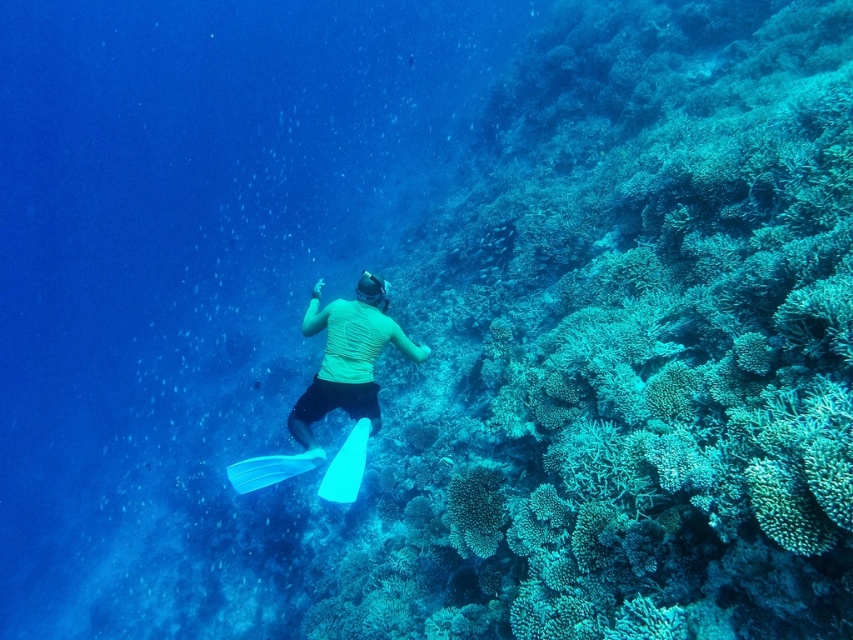
You are an underwater photographer aiming to capture a closeup of the green textured coral at center without the transparent plastic paddle at lower center blocking the view. Based on their heights, can you position yourself below the coral to frame the shot?

The green textured coral at center has a lesser height compared to transparent plastic paddle at lower center. Positioning yourself below the coral would allow the shot since the paddle is taller and might block the view from above, but being lower could let you capture the coral without obstruction.

You are an underwater photographer aiming to capture the green textured coral reef at center and the transparent plastic paddle at lower center in a single shot. Which object will appear closer to the camera in the photo?

The green textured coral reef at center will appear closer to the camera because the transparent plastic paddle at lower center is behind it.

You are an underwater photographer aiming to capture a clear shot of the diver and the coral reef. You notice two points of interest marked as point 1 at coordinates point (358, 445) and point 2 at coordinates point (311, 456). Which point should you focus on to ensure the subject is closer to the camera?

Point 1 at coordinates point (358, 445) is closer to the viewer than point 2 at coordinates point (311, 456), so you should focus on point 1 to ensure the subject is closer to the camera.